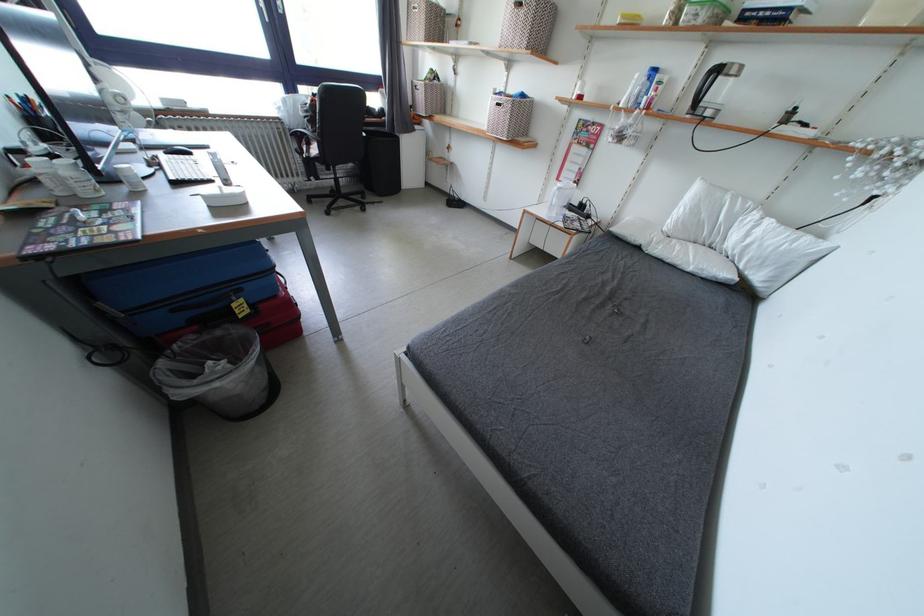
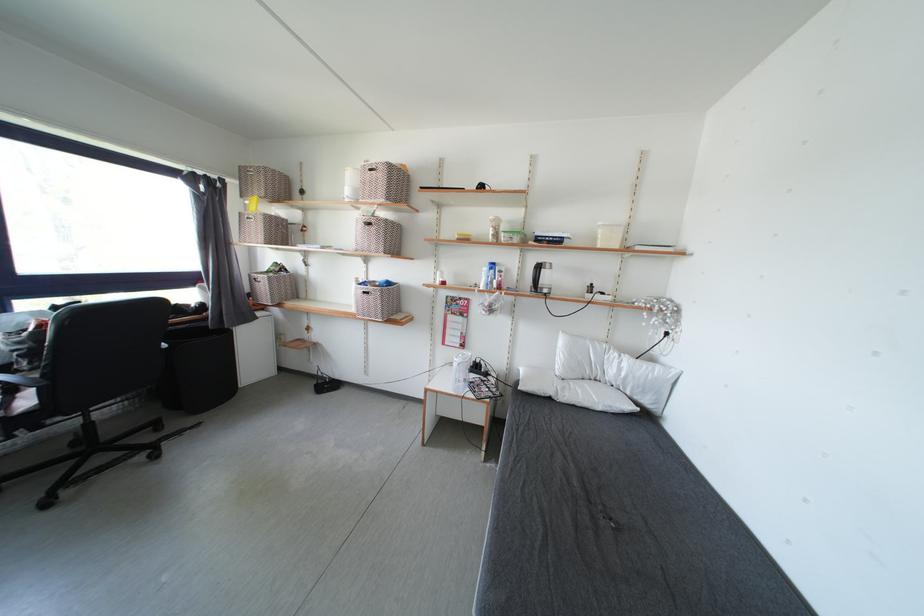
Locate, in the second image, the point that corresponds to the point at 504,110 in the first image.

(371, 297)